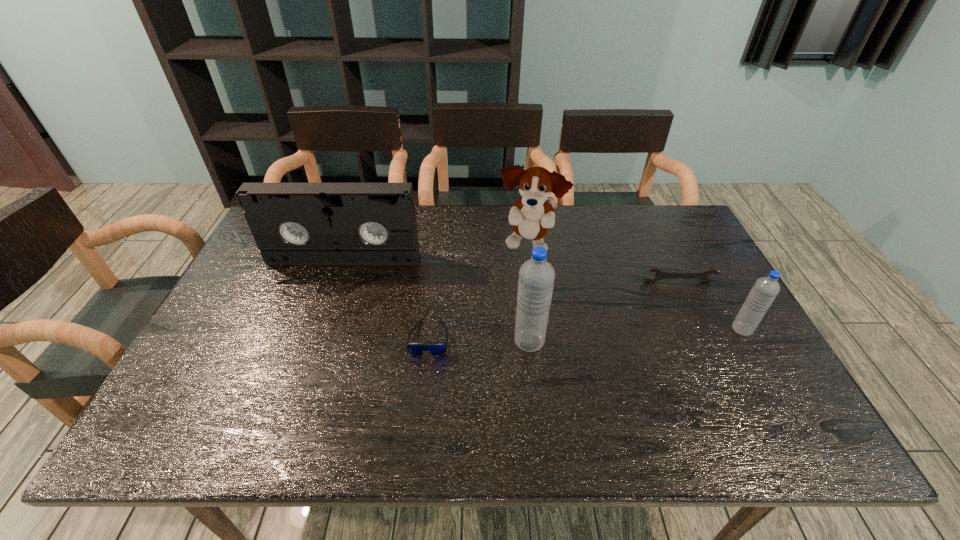
Where is `free space at the right edge`? free space at the right edge is located at coordinates (670, 251).

Find the location of a particular element. vacant space at the far right corner of the desktop is located at coordinates (680, 208).

In the image, there is a desktop. At what (x,y) coordinates should I click in order to perform the action: click on vacant space at the near right corner. Please return your answer as a coordinate pair (x, y). Image resolution: width=960 pixels, height=540 pixels. Looking at the image, I should click on (796, 405).

Locate an element on the screen. Image resolution: width=960 pixels, height=540 pixels. free spot between the puppy and the videotape is located at coordinates (436, 253).

Where is `empty space between the sunglasses and the wrench`? The width and height of the screenshot is (960, 540). empty space between the sunglasses and the wrench is located at coordinates (554, 310).

The image size is (960, 540). I want to click on free space between the right water bottle and the third farthest object, so click(x=709, y=306).

The width and height of the screenshot is (960, 540). What are the coordinates of `unoccupied area between the leftmost object and the taller water bottle` in the screenshot? It's located at (437, 300).

You are a GUI agent. You are given a task and a screenshot of the screen. Output one action in this format:
    pyautogui.click(x=<x>, y=<y>)
    Task: Click on the free space between the wrench and the sunglasses
    
    Given the screenshot: What is the action you would take?
    pyautogui.click(x=554, y=310)

This screenshot has height=540, width=960. Identify the location of free space between the second object from left to right and the third farthest object. (554, 310).

Identify the location of empty location between the sunglasses and the left water bottle. (479, 340).